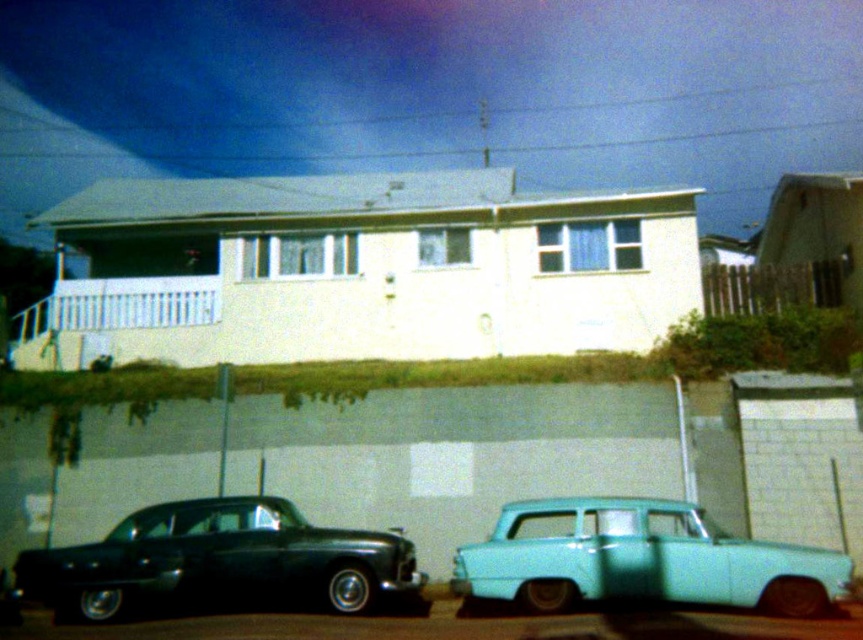
Question: Among these points, which one is farthest from the camera?

Choices:
 (A) (569, 509)
 (B) (79, 572)

Answer: (A)

Question: Does shiny black sedan at lower left have a smaller size compared to light blue matte car at lower right?

Choices:
 (A) yes
 (B) no

Answer: (B)

Question: Which point is closer to the camera?

Choices:
 (A) (620, 593)
 (B) (124, 593)

Answer: (A)

Question: Does shiny black sedan at lower left appear on the left side of light blue matte car at lower right?

Choices:
 (A) no
 (B) yes

Answer: (B)

Question: Which point is closer to the camera?

Choices:
 (A) light blue matte car at lower right
 (B) shiny black sedan at lower left

Answer: (A)

Question: Is shiny black sedan at lower left bigger than light blue matte car at lower right?

Choices:
 (A) no
 (B) yes

Answer: (B)